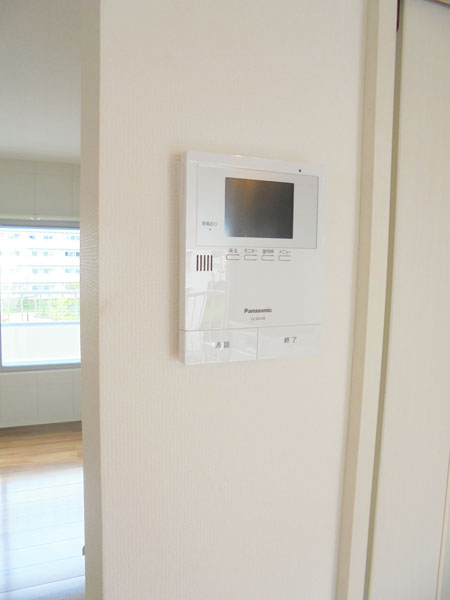
You are a GUI agent. You are given a task and a screenshot of the screen. Output one action in this format:
    pyautogui.click(x=<x>, y=<y>)
    Task: Click on the doorway
    
    Given the screenshot: What is the action you would take?
    pyautogui.click(x=42, y=491)